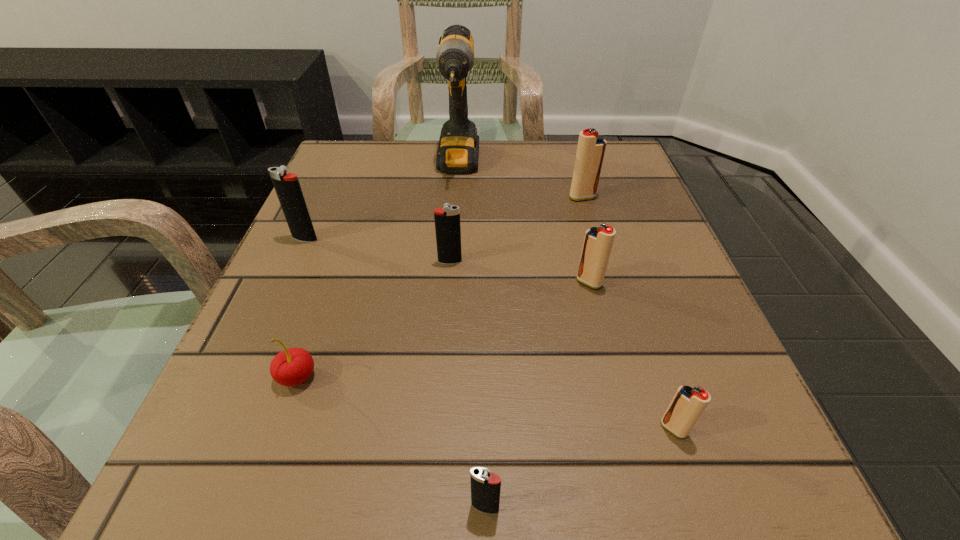
This screenshot has height=540, width=960. What are the coordinates of `drill` in the screenshot? It's located at (458, 150).

Where is `the biggest red igniter`? the biggest red igniter is located at coordinates (591, 147).

At what (x,y) coordinates should I click in order to perform the action: click on the farthest igniter. Please return your answer as a coordinate pair (x, y). The width and height of the screenshot is (960, 540). Looking at the image, I should click on (591, 147).

I want to click on the leftmost igniter, so click(287, 186).

Identify the location of the farthest black igniter. This screenshot has width=960, height=540. (287, 186).

Find the location of `the second black igniter from left to right`. the second black igniter from left to right is located at coordinates (447, 220).

Where is `the second igniter from left to right`? the second igniter from left to right is located at coordinates (447, 220).

You are a GUI agent. You are given a task and a screenshot of the screen. Output one action in this format:
    pyautogui.click(x=<x>, y=<y>)
    Task: Click on the second smallest red igniter
    The height and width of the screenshot is (540, 960).
    Given the screenshot: What is the action you would take?
    pyautogui.click(x=598, y=242)

At what (x,y) coordinates should I click in order to perform the action: click on the third nearest igniter. Please return your answer as a coordinate pair (x, y). This screenshot has width=960, height=540. Looking at the image, I should click on (598, 242).

The height and width of the screenshot is (540, 960). I want to click on red cherry, so click(293, 366).